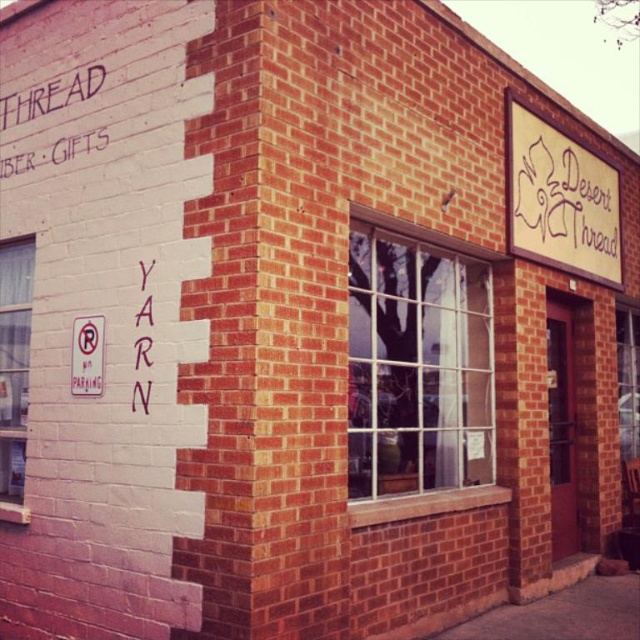
Consider the image. You are standing at the entrance of Desert Thread and want to read the white chalk writing at upper left. The clear glass window at center is in your way. Can you walk around it to reach the writing?

The clear glass window at center is 2.98 meters away from the white chalk writing at upper left, so you can walk around the window to reach the writing.

You are a delivery person trying to see the shop name on the beige textured sign at upper right but you are blocked by the clear glass window at center. Can you still see the sign?

The beige textured sign at upper right is larger than the clear glass window at center, so the sign might still be visible around or above the window.